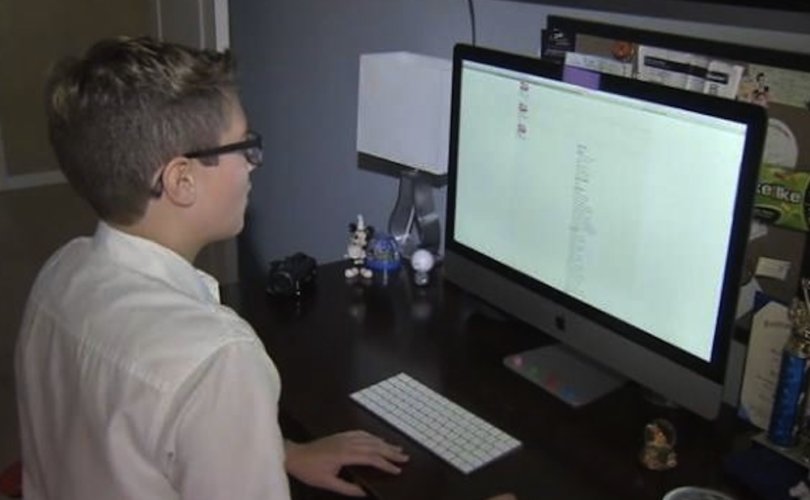
Image resolution: width=810 pixels, height=500 pixels. Identify the location of cork board. (770, 204).